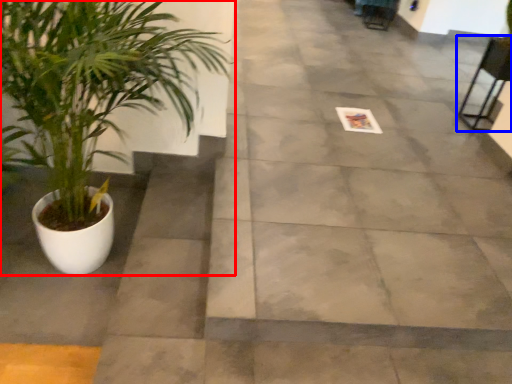
Question: Which object is further to the camera taking this photo, houseplant (highlighted by a red box) or chair (highlighted by a blue box)?

Choices:
 (A) houseplant
 (B) chair

Answer: (B)